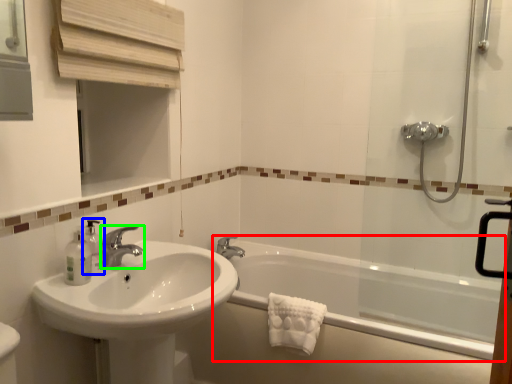
Question: Which object is the closest to the bathtub (highlighted by a red box)? Choose among these: soap dispenser (highlighted by a blue box) or tap (highlighted by a green box).

Choices:
 (A) soap dispenser
 (B) tap

Answer: (B)